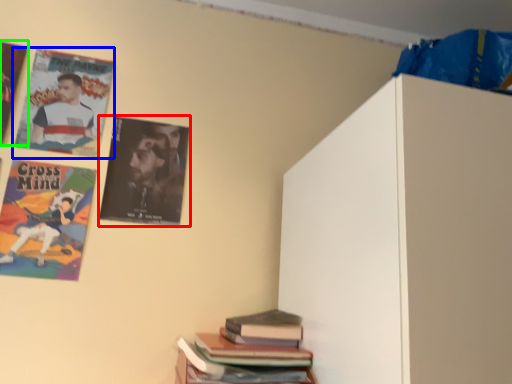
Question: Which object is positioned farthest from poster (highlighted by a red box)? Select from poster (highlighted by a blue box) and poster (highlighted by a green box).

Choices:
 (A) poster
 (B) poster

Answer: (B)